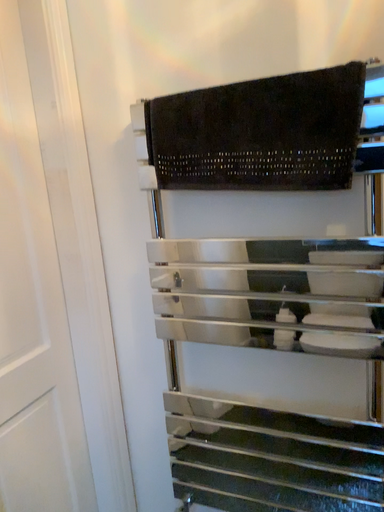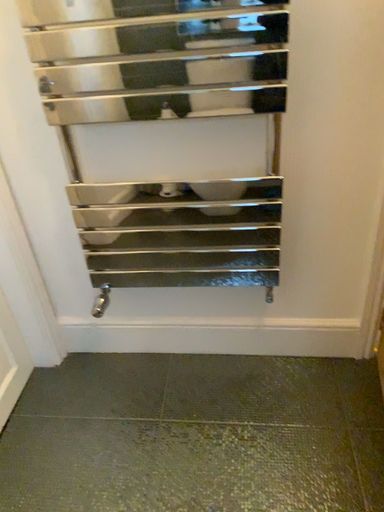
Question: Which way did the camera rotate in the video?

Choices:
 (A) rotated downward
 (B) rotated upward

Answer: (A)